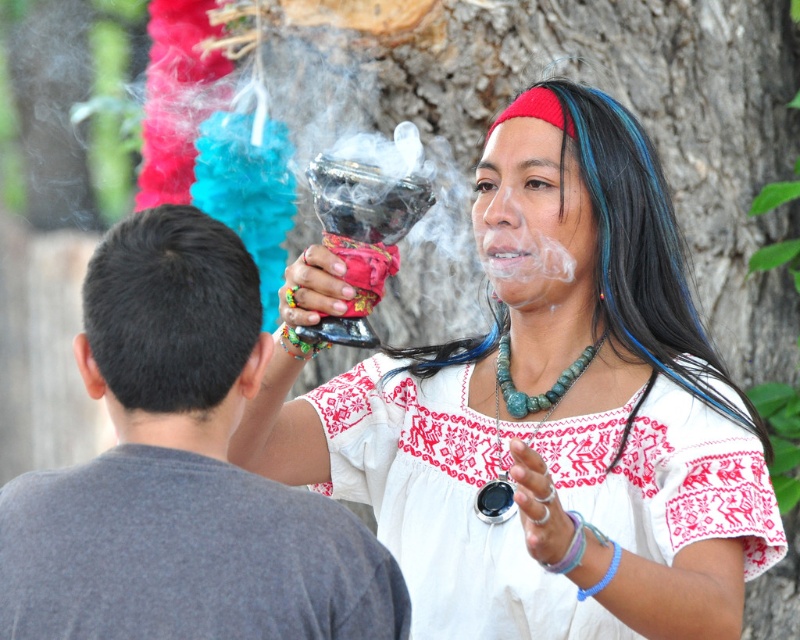
Question: Which is farther from the turquoise stone necklace at center?

Choices:
 (A) matte black bowl at upper center
 (B) white embroidered dress at center
 (C) gray cotton shirt at upper left

Answer: (C)

Question: Where is gray cotton shirt at upper left located in relation to turquoise stone necklace at center in the image?

Choices:
 (A) left
 (B) right

Answer: (A)

Question: Can you confirm if matte black bowl at upper center is positioned above white embroidered dress at center?

Choices:
 (A) yes
 (B) no

Answer: (A)

Question: Which point is farther to the camera?

Choices:
 (A) (562, 385)
 (B) (688, 486)

Answer: (A)

Question: Which is farther from the white embroidered dress at center?

Choices:
 (A) matte black bowl at upper center
 (B) gray cotton shirt at upper left

Answer: (B)

Question: Does matte black bowl at upper center appear under white embroidered dress at center?

Choices:
 (A) no
 (B) yes

Answer: (A)